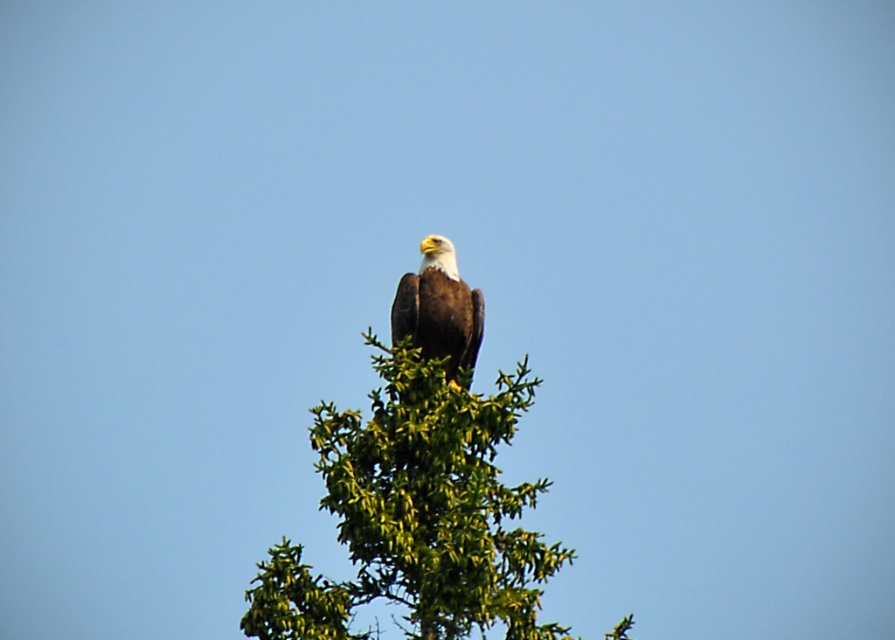
Is point (456, 547) in front of point (413, 308)?

Yes.

Between green leafy tree at center and brown feathered eagle at center, which one has less height?

brown feathered eagle at center

Which is behind, point (275, 612) or point (429, 323)?

Positioned behind is point (429, 323).

At what (x,y) coordinates should I click in order to perform the action: click on green leafy tree at center. Please return your answer as a coordinate pair (x, y). The image size is (895, 640). Looking at the image, I should click on (416, 515).